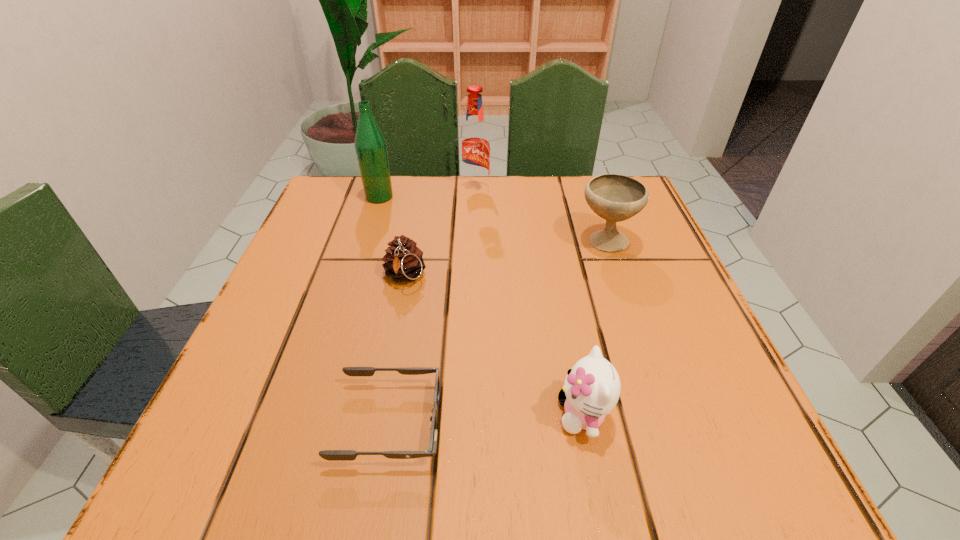
Identify the location of the fourth object from left to right. This screenshot has width=960, height=540. [x=475, y=144].

The width and height of the screenshot is (960, 540). What are the coordinates of `the leftmost object` in the screenshot? It's located at (370, 144).

Locate an element on the screen. This screenshot has width=960, height=540. chalice is located at coordinates (613, 197).

This screenshot has width=960, height=540. In order to click on the fourth nearest object in this screenshot , I will do `click(613, 197)`.

Locate an element on the screen. The width and height of the screenshot is (960, 540). the second object from right to left is located at coordinates (592, 387).

Identify the location of the second shortest object. The width and height of the screenshot is (960, 540). click(x=403, y=261).

At what (x,y) coordinates should I click in order to perform the action: click on the fourth farthest object. Please return your answer as a coordinate pair (x, y). Looking at the image, I should click on (403, 261).

What are the coordinates of `sunglasses` in the screenshot? It's located at (331, 455).

Identify the location of vacant region located on the front of the third object from right to left. The width and height of the screenshot is (960, 540). (473, 313).

This screenshot has width=960, height=540. Find the location of `vacant space located on the front of the leftmost object`. vacant space located on the front of the leftmost object is located at coordinates (338, 329).